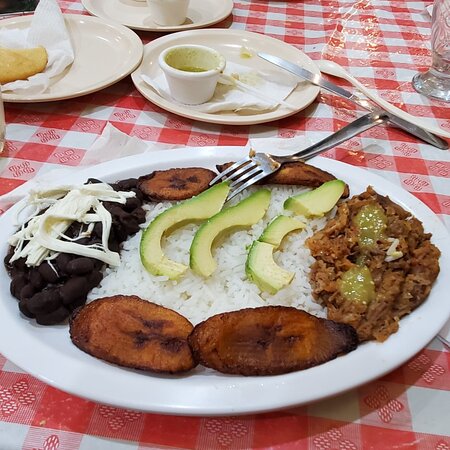
The image size is (450, 450). I want to click on metal utensil, so click(x=325, y=142), click(x=344, y=95).